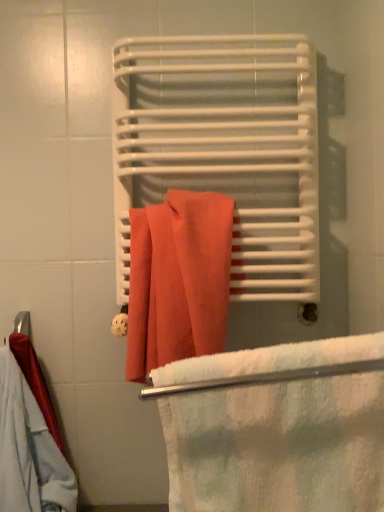
I want to click on matte orange towel at center, so click(x=224, y=149).

Measure the distance between point (163, 356) and camera.

Point (163, 356) and camera are 37.20 inches apart from each other.

This screenshot has height=512, width=384. Describe the element at coordinates (178, 280) in the screenshot. I see `cotton towel at center` at that location.

Image resolution: width=384 pixels, height=512 pixels. What are the coordinates of `matte orange towel at center` in the screenshot? It's located at (224, 149).

Could you tell me if cotton towel at center is facing white soft towel at center?

Yes, cotton towel at center is turned towards white soft towel at center.

From the image's perspective, which one is positioned higher, cotton towel at center or white soft towel at center?

cotton towel at center is shown above in the image.

In terms of width, does cotton towel at center look wider or thinner when compared to white soft towel at center?

A: cotton towel at center is thinner than white soft towel at center.

From a real-world perspective, is cotton towel at center located beneath white soft towel at center?

No, from a real-world perspective, cotton towel at center is not under white soft towel at center.

From a real-world perspective, is matte orange towel at center positioned above or below white soft towel at center?

matte orange towel at center is situated higher than white soft towel at center in the real world.

Is matte orange towel at center not close to white soft towel at center?

Actually, matte orange towel at center and white soft towel at center are a little close together.

Does matte orange towel at center have a lesser height compared to white soft towel at center?

In fact, matte orange towel at center may be taller than white soft towel at center.

From the image's perspective, is matte orange towel at center located above or below white soft towel at center?

Based on their image positions, matte orange towel at center is located above white soft towel at center.

Do you think matte orange towel at center is within cotton towel at center, or outside of it?

matte orange towel at center is not enclosed by cotton towel at center.

From a real-world perspective, which object rests below the other?

In real-world perspective, cotton towel at center is lower.

From the image's perspective, which is above, matte orange towel at center or cotton towel at center?

matte orange towel at center appears higher in the image.

Considering the points (314, 205) and (222, 332), which point is in front, point (314, 205) or point (222, 332)?

The point (222, 332) is closer to the camera.

Can you confirm if cotton towel at center is wider than matte orange towel at center?

No.

Consider the image. How much distance is there between cotton towel at center and matte orange towel at center?

cotton towel at center and matte orange towel at center are 7.18 inches apart.

Considering their positions, is cotton towel at center located in front of or behind matte orange towel at center?

In the image, cotton towel at center appears in front of matte orange towel at center.

Is cotton towel at center not near matte orange towel at center?

No, cotton towel at center is not far from matte orange towel at center.

Can you tell me how much white soft towel at center and matte orange towel at center differ in facing direction?

They differ by 3.27e-05 degrees in their facing directions.

Consider the image. Is white soft towel at center far away from matte orange towel at center?

No, there isn't a large distance between white soft towel at center and matte orange towel at center.

Which of these two, white soft towel at center or matte orange towel at center, is smaller?

With smaller size is white soft towel at center.

How much distance is there between white soft towel at center and matte orange towel at center?

A distance of 21.95 inches exists between white soft towel at center and matte orange towel at center.

From the image's perspective, who appears lower, white soft towel at center or cotton towel at center?

white soft towel at center is shown below in the image.

Is point (318, 398) in front of point (194, 337)?

Yes, point (318, 398) is closer to viewer.

Is white soft towel at center beside cotton towel at center?

There is a gap between white soft towel at center and cotton towel at center.

Would you say white soft towel at center is outside cotton towel at center?

Yes, white soft towel at center is located beyond the bounds of cotton towel at center.

Locate an element on the screen. beach towel that appears on the right of cotton towel at center is located at coordinates (278, 446).

The width and height of the screenshot is (384, 512). I want to click on bath towel that appears on the left of white soft towel at center, so click(224, 149).

Looking at the image, which one is located further to cotton towel at center, matte orange towel at center or white soft towel at center?

white soft towel at center is positioned further to the anchor cotton towel at center.

Looking at the image, which one is located closer to cotton towel at center, white soft towel at center or matte orange towel at center?

Among the two, matte orange towel at center is located nearer to cotton towel at center.

Looking at the image, which one is located further to matte orange towel at center, cotton towel at center or white soft towel at center?

white soft towel at center lies further to matte orange towel at center than the other object.

From the image, which object appears to be farther from white soft towel at center, matte orange towel at center or cotton towel at center?

matte orange towel at center is positioned further to the anchor white soft towel at center.

From the image, which object appears to be nearer to white soft towel at center, cotton towel at center or matte orange towel at center?

The object closer to white soft towel at center is cotton towel at center.

From the picture: When comparing their distances from matte orange towel at center, does white soft towel at center or cotton towel at center seem further?

white soft towel at center is positioned further to the anchor matte orange towel at center.

You are a GUI agent. You are given a task and a screenshot of the screen. Output one action in this format:
    pyautogui.click(x=<x>, y=<y>)
    Task: Click on the towel positioned between white soft towel at center and matte orange towel at center from near to far
    This screenshot has width=384, height=512.
    Given the screenshot: What is the action you would take?
    tap(178, 280)